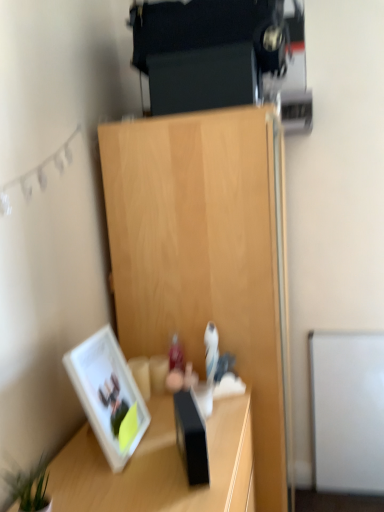
Question: Is wooden desk at lower left at the back of white glossy picture frame at lower left?

Choices:
 (A) no
 (B) yes

Answer: (A)

Question: Can you confirm if white glossy picture frame at lower left is shorter than wooden desk at lower left?

Choices:
 (A) no
 (B) yes

Answer: (B)

Question: From the image's perspective, is white glossy picture frame at lower left on top of wooden desk at lower left?

Choices:
 (A) no
 (B) yes

Answer: (B)

Question: From the image's perspective, is white glossy picture frame at lower left under wooden desk at lower left?

Choices:
 (A) yes
 (B) no

Answer: (B)

Question: Does white glossy picture frame at lower left contain wooden desk at lower left?

Choices:
 (A) yes
 (B) no

Answer: (B)

Question: In terms of height, does white glossy picture frame at lower left look taller or shorter compared to light wood cabinet at center?

Choices:
 (A) tall
 (B) short

Answer: (B)

Question: Is point (122, 371) positioned closer to the camera than point (173, 164)?

Choices:
 (A) farther
 (B) closer

Answer: (B)

Question: From the image's perspective, is white glossy picture frame at lower left located above or below light wood cabinet at center?

Choices:
 (A) above
 (B) below

Answer: (A)

Question: Choose the correct answer: Is white glossy picture frame at lower left inside light wood cabinet at center or outside it?

Choices:
 (A) inside
 (B) outside

Answer: (B)

Question: Do you think light wood cabinet at center is within white glossy picture frame at lower left, or outside of it?

Choices:
 (A) outside
 (B) inside

Answer: (A)

Question: Is light wood cabinet at center to the left or to the right of white glossy picture frame at lower left in the image?

Choices:
 (A) left
 (B) right

Answer: (B)

Question: From their relative heights in the image, would you say light wood cabinet at center is taller or shorter than white glossy picture frame at lower left?

Choices:
 (A) tall
 (B) short

Answer: (A)

Question: Is light wood cabinet at center bigger or smaller than white glossy picture frame at lower left?

Choices:
 (A) big
 (B) small

Answer: (A)

Question: Is point [82, 381] positioned closer to the camera than point [41, 502]?

Choices:
 (A) farther
 (B) closer

Answer: (A)

Question: Based on their positions, is white glossy picture frame at lower left located to the left or right of green leafy plant at lower left?

Choices:
 (A) left
 (B) right

Answer: (B)